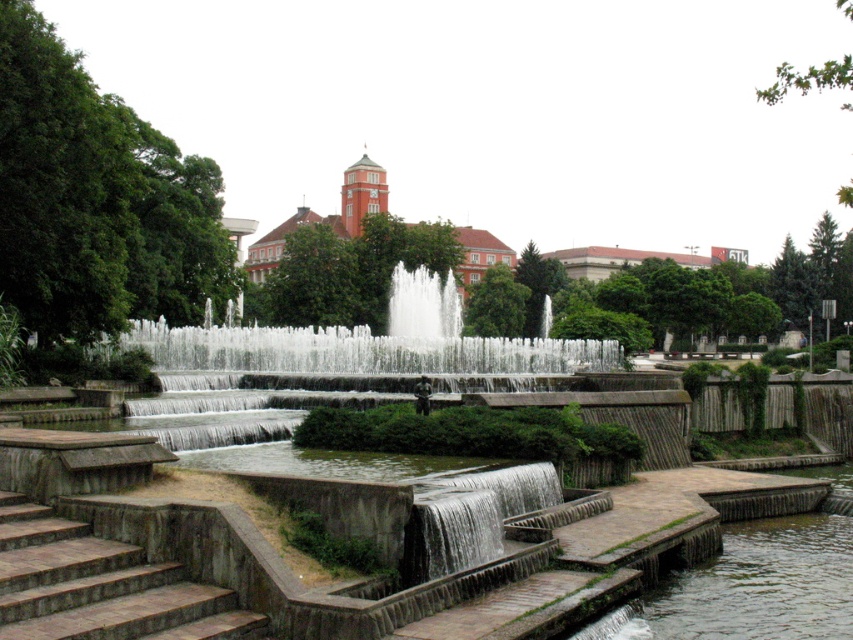
You are standing at the edge of the park and want to reach the smooth concrete waterfall at lower center. There are brown stone stairs at lower left in your path. Can you walk directly to the waterfall without going around the stairs?

The brown stone stairs at lower left are in front of the smooth concrete waterfall at lower center, so you would need to navigate around them to reach the waterfall directly.

You are a landscape architect designing a walking path between the clear concrete waterfall at center and the smooth concrete waterfall at lower center. What is the minimum length the path should be to ensure it reaches both waterfalls?

The minimum length of the path should be at least 38.98 meters to ensure it reaches both the clear concrete waterfall at center and the smooth concrete waterfall at lower center.